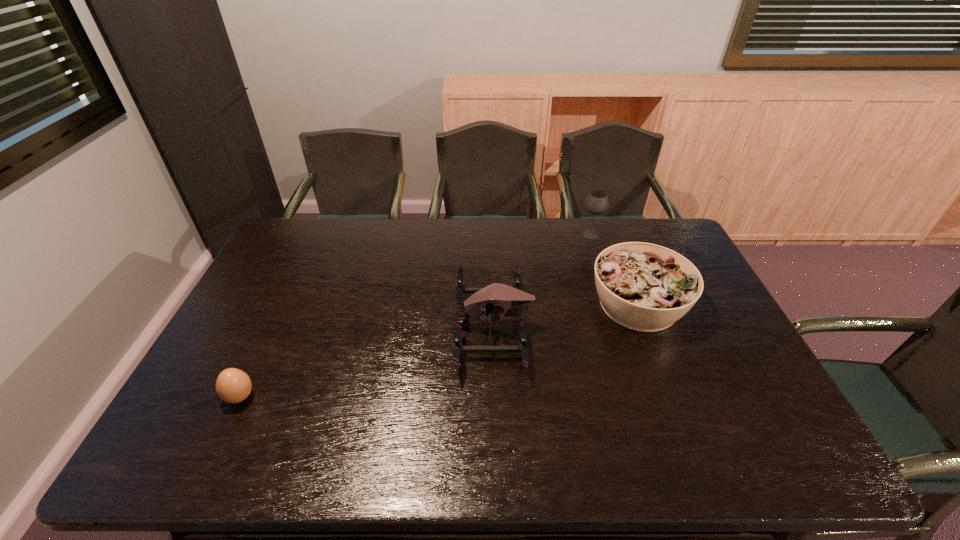
Locate which object ranks second in proximity to the farthest object. Please provide its 2D coordinates. Your answer should be formatted as a tuple, i.e. [(x, y)], where the tuple contains the x and y coordinates of a point satisfying the conditions above.

[(509, 299)]

The height and width of the screenshot is (540, 960). What are the coordinates of `vacant space that satisfies the following two spatial constraints: 1. on the front-facing side of the drone; 2. on the front side of the shortest object` in the screenshot? It's located at (495, 397).

The image size is (960, 540). In order to click on vacant space that satisfies the following two spatial constraints: 1. on the back side of the salad; 2. on the right side of the shortest object in this screenshot , I will do (284, 305).